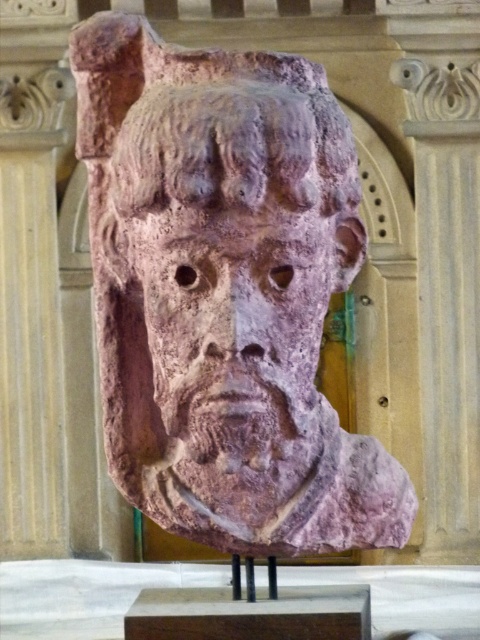
Question: Can you confirm if rustic stone mask at center is positioned below rustic stone face at center?

Choices:
 (A) yes
 (B) no

Answer: (B)

Question: Is rustic stone mask at center closer to the viewer compared to rustic stone face at center?

Choices:
 (A) yes
 (B) no

Answer: (A)

Question: Can you confirm if rustic stone mask at center is thinner than rustic stone face at center?

Choices:
 (A) no
 (B) yes

Answer: (A)